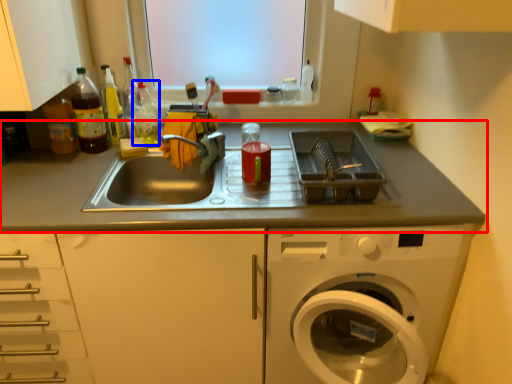
Question: Which object is further to the camera taking this photo, countertop (highlighted by a red box) or bottle (highlighted by a blue box)?

Choices:
 (A) countertop
 (B) bottle

Answer: (B)